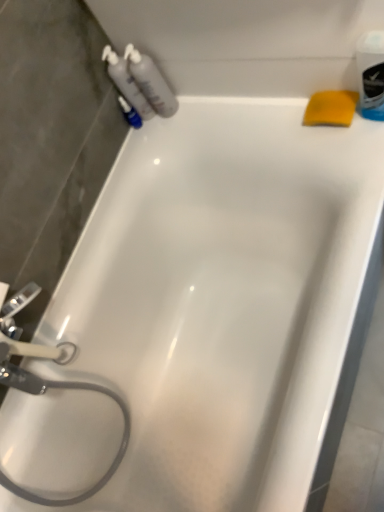
Where is `free space between translucent plastic bottles at upper left, which is the 2th cleaning product in right-to-left order, and blue plastic mouthwash at upper right`? This screenshot has height=512, width=384. free space between translucent plastic bottles at upper left, which is the 2th cleaning product in right-to-left order, and blue plastic mouthwash at upper right is located at coordinates (243, 112).